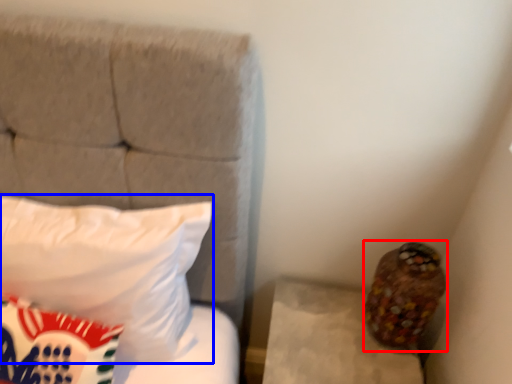
Question: Which object is closer to the camera taking this photo, stuff (highlighted by a red box) or pillow (highlighted by a blue box)?

Choices:
 (A) stuff
 (B) pillow

Answer: (B)